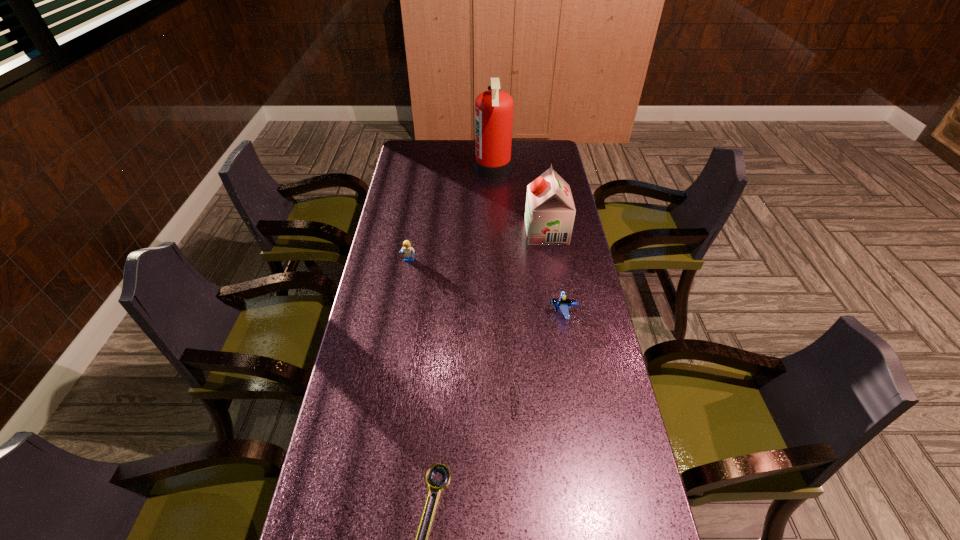
At what (x,y) coordinates should I click in order to perform the action: click on free space located at the nozzle of the fire extinguisher. Please return your answer as a coordinate pair (x, y). Looking at the image, I should click on (450, 169).

You are a GUI agent. You are given a task and a screenshot of the screen. Output one action in this format:
    pyautogui.click(x=<x>, y=<y>)
    Task: Click on the vacant space located at the nozzle of the fire extinguisher
    The width and height of the screenshot is (960, 540).
    Given the screenshot: What is the action you would take?
    pyautogui.click(x=457, y=169)

What are the coordinates of `free space located at the nozzle of the fire extinguisher` in the screenshot? It's located at (454, 169).

The image size is (960, 540). Find the location of `vacant space situated 0.220m with the cap open on the soya milk`. vacant space situated 0.220m with the cap open on the soya milk is located at coordinates [x=468, y=232].

Where is `vacant region located 0.240m with the cap open on the soya milk`? vacant region located 0.240m with the cap open on the soya milk is located at coordinates (464, 232).

You are a GUI agent. You are given a task and a screenshot of the screen. Output one action in this format:
    pyautogui.click(x=<x>, y=<y>)
    Task: Click on the free space located 0.090m with the cap open on the soya milk
    
    Given the screenshot: What is the action you would take?
    pyautogui.click(x=503, y=232)

The width and height of the screenshot is (960, 540). I want to click on blank space located 0.050m on the front-facing side of the farther Lego, so click(407, 275).

The height and width of the screenshot is (540, 960). In order to click on free space located 0.050m on the front-facing side of the right Lego in this screenshot , I will do `click(533, 312)`.

Where is `vacant space located 0.210m on the front-facing side of the right Lego`? vacant space located 0.210m on the front-facing side of the right Lego is located at coordinates (483, 312).

Find the location of a particular element. The width and height of the screenshot is (960, 540). blank area located 0.130m on the front-facing side of the right Lego is located at coordinates (508, 312).